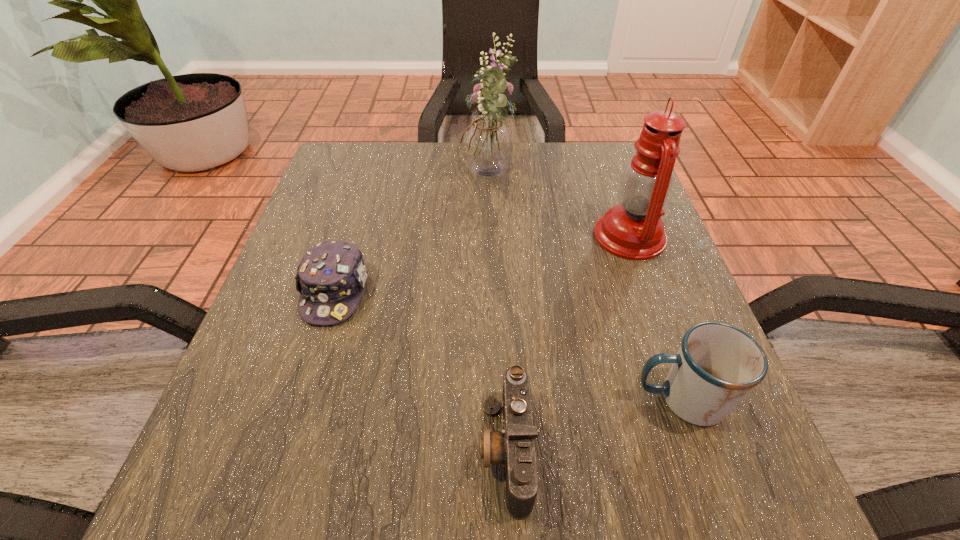
Image resolution: width=960 pixels, height=540 pixels. In order to click on the closest object to the third shortest object in this screenshot , I will do `click(514, 447)`.